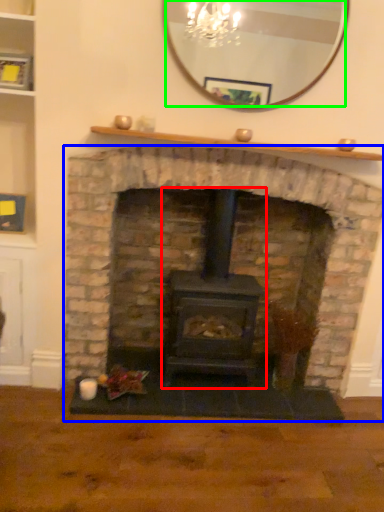
Question: Which object is the farthest from wood burning stove (highlighted by a red box)? Choose among these: fireplace (highlighted by a blue box) or mirror (highlighted by a green box).

Choices:
 (A) fireplace
 (B) mirror

Answer: (B)